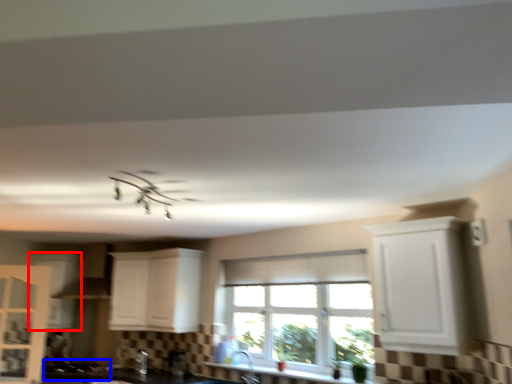
Question: Which object appears farthest to the camera in this image, cabinetry (highlighted by a red box) or gas stove (highlighted by a blue box)?

Choices:
 (A) cabinetry
 (B) gas stove

Answer: (A)